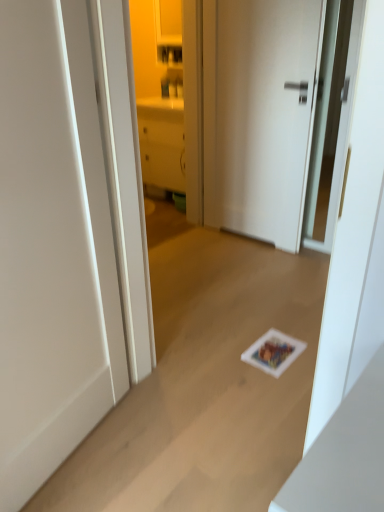
The width and height of the screenshot is (384, 512). I want to click on matte white cabinet at center, so click(170, 100).

Measure the distance between point (314, 78) and camera.

The depth of point (314, 78) is 2.61 meters.

Where is `matte white cabinet at center`? This screenshot has height=512, width=384. matte white cabinet at center is located at coordinates (170, 100).

Is white matte door at center, which is the first door from right to left, with matte white cabinet at center?

No, white matte door at center, which is the first door from right to left, is not making contact with matte white cabinet at center.

From a real-world perspective, is white matte door at center, the 1th door when ordered from back to front, physically located above or below matte white cabinet at center?

From a real-world perspective, white matte door at center, the 1th door when ordered from back to front, is physically below matte white cabinet at center.

How distant is white matte door at center, the second door in the front-to-back sequence, from matte white cabinet at center?

1.05 meters.

Is white matte door at center, which is the first door from right to left, positioned with its back to matte white cabinet at center?

white matte door at center, which is the first door from right to left, does not have its back to matte white cabinet at center.

Does white matte door at center, the 1th door when ordered from back to front, have a larger size compared to white matte door at center, acting as the second door starting from the right?

No, white matte door at center, the 1th door when ordered from back to front, is not bigger than white matte door at center, acting as the second door starting from the right.

From a real-world perspective, is white matte door at center, the 1th door when ordered from back to front, located higher than white matte door at center, the first door from the front?

Correct, in the physical world, white matte door at center, the 1th door when ordered from back to front, is higher than white matte door at center, the first door from the front.

Is white matte door at center, the 1th door when ordered from back to front, wider than white matte door at center, acting as the second door starting from the right?

Answer: In fact, white matte door at center, the 1th door when ordered from back to front, might be narrower than white matte door at center, acting as the second door starting from the right.

Between white matte door at center, the second door when ordered from left to right, and white matte door at center, which is the 2th door from back to front, which one appears on the left side from the viewer's perspective?

white matte door at center, which is the 2th door from back to front, is more to the left.

Is white matte door at center, acting as the second door starting from the right, at the left side of white matte door at center, the 1th door when ordered from back to front?

Correct, you'll find white matte door at center, acting as the second door starting from the right, to the left of white matte door at center, the 1th door when ordered from back to front.

From the image's perspective, does white matte door at center, which is the 2th door from back to front, appear higher than white matte door at center, the 1th door when ordered from back to front?

Incorrect, from the image's perspective, white matte door at center, which is the 2th door from back to front, is lower than white matte door at center, the 1th door when ordered from back to front.

Which is in front, white matte door at center, acting as the second door starting from the right, or white matte door at center, the second door when ordered from left to right?

Positioned in front is white matte door at center, acting as the second door starting from the right.

From a real-world perspective, which object stands above the other?

matte white cabinet at center.

Considering the relative sizes of matte white cabinet at center and white matte door at center, acting as the second door starting from the right, in the image provided, is matte white cabinet at center taller than white matte door at center, acting as the second door starting from the right,?

Correct, matte white cabinet at center is much taller as white matte door at center, acting as the second door starting from the right.

Considering the sizes of matte white cabinet at center and white matte door at center, the 1th door viewed from the left, in the image, is matte white cabinet at center bigger or smaller than white matte door at center, the 1th door viewed from the left,?

matte white cabinet at center is bigger than white matte door at center, the 1th door viewed from the left.

Considering the sizes of matte white cabinet at center and white matte door at center, the 1th door viewed from the left, in the image, is matte white cabinet at center wider or thinner than white matte door at center, the 1th door viewed from the left,?

In the image, matte white cabinet at center appears to be wider than white matte door at center, the 1th door viewed from the left.

From the image's perspective, is matte white cabinet at center positioned above or below white matte door at center, the 1th door when ordered from back to front?

Based on their image positions, matte white cabinet at center is located above white matte door at center, the 1th door when ordered from back to front.

Between matte white cabinet at center and white matte door at center, the 1th door when ordered from back to front, which one appears on the left side from the viewer's perspective?

Positioned to the left is matte white cabinet at center.

Is matte white cabinet at center shorter than white matte door at center, the second door when ordered from left to right?

No, matte white cabinet at center is not shorter than white matte door at center, the second door when ordered from left to right.

Which is nearer, (175, 34) or (218, 12)?

Point (175, 34) is farther from the camera than point (218, 12).

Are white matte door at center, which is the 2th door from back to front, and matte white cabinet at center making contact?

No.

Could matte white cabinet at center be considered to be inside white matte door at center, the first door from the front?

That's incorrect, matte white cabinet at center is not inside white matte door at center, the first door from the front.

From a real-world perspective, is white matte door at center, which is the 2th door from back to front, positioned over matte white cabinet at center based on gravity?

Actually, white matte door at center, which is the 2th door from back to front, is physically below matte white cabinet at center in the real world.

You are a GUI agent. You are given a task and a screenshot of the screen. Output one action in this format:
    pyautogui.click(x=<x>, y=<y>)
    Task: Click on the 1st door in front of the matte white cabinet at center, counting from the anchor's position
    This screenshot has height=512, width=384.
    Given the screenshot: What is the action you would take?
    pyautogui.click(x=259, y=114)

Locate an element on the screen. Image resolution: width=384 pixels, height=512 pixels. door that appears behind the white matte door at center, which is the 2th door from back to front is located at coordinates (259, 114).

Which object lies nearer to the anchor point white matte door at center, the second door when ordered from left to right, matte white cabinet at center or white matte door at center, acting as the second door starting from the right?

Based on the image, matte white cabinet at center appears to be nearer to white matte door at center, the second door when ordered from left to right.

Estimate the real-world distances between objects in this image. Which object is further from white matte door at center, which is the 2th door from back to front, matte white cabinet at center or white matte door at center, the second door in the front-to-back sequence?

The object further to white matte door at center, which is the 2th door from back to front, is matte white cabinet at center.

Looking at the image, which one is located closer to matte white cabinet at center, white matte door at center, which is the 2th door from back to front, or white matte door at center, the second door in the front-to-back sequence?

white matte door at center, the second door in the front-to-back sequence, lies closer to matte white cabinet at center than the other object.

Considering their positions, is white matte door at center, the 1th door when ordered from back to front, positioned closer to white matte door at center, acting as the second door starting from the right, than matte white cabinet at center?

white matte door at center, the 1th door when ordered from back to front, is closer to white matte door at center, acting as the second door starting from the right.

Based on their spatial positions, is white matte door at center, the 1th door when ordered from back to front, or white matte door at center, acting as the second door starting from the right, closer to matte white cabinet at center?

Among the two, white matte door at center, the 1th door when ordered from back to front, is located nearer to matte white cabinet at center.

Looking at the image, which one is located further to white matte door at center, the second door in the front-to-back sequence, white matte door at center, the 1th door viewed from the left, or matte white cabinet at center?

white matte door at center, the 1th door viewed from the left.

Find the location of a particular element. This screenshot has width=384, height=512. door between white matte door at center, which is the 2th door from back to front, and matte white cabinet at center in the front-back direction is located at coordinates (259, 114).